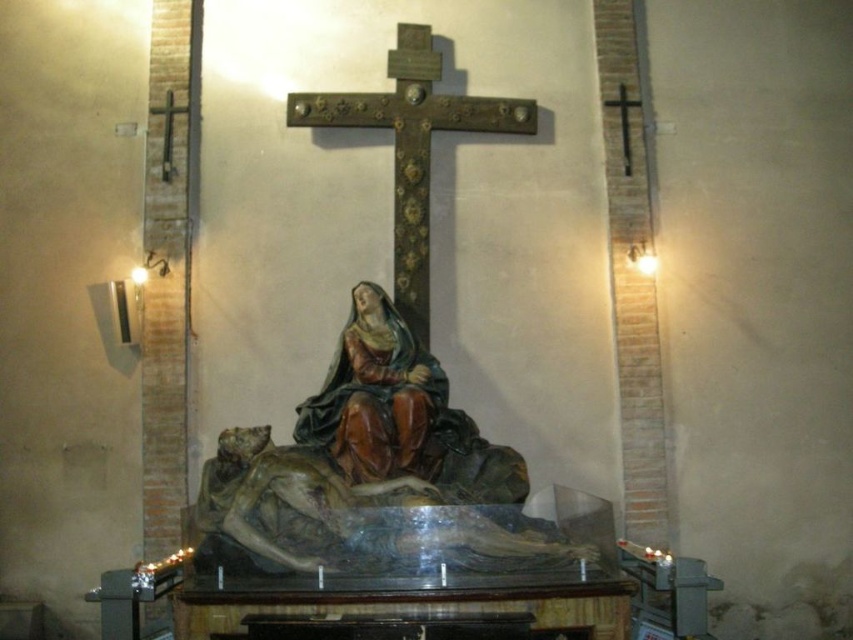
Question: Observing the image, what is the correct spatial positioning of wooden statue at center in reference to polished wood cross at center?

Choices:
 (A) below
 (B) above

Answer: (A)

Question: Does wooden statue at center have a larger size compared to polished wood cross at center?

Choices:
 (A) no
 (B) yes

Answer: (A)

Question: Is polished wood cross at center positioned at the back of black wood cross at upper right?

Choices:
 (A) yes
 (B) no

Answer: (B)

Question: Which point is closer to the camera taking this photo?

Choices:
 (A) (422, 284)
 (B) (366, 348)

Answer: (B)

Question: Which point is closer to the camera?

Choices:
 (A) (421, 353)
 (B) (624, 92)

Answer: (A)

Question: Which object is closer to the camera taking this photo?

Choices:
 (A) matte brown statue at center
 (B) wooden statue at center

Answer: (B)